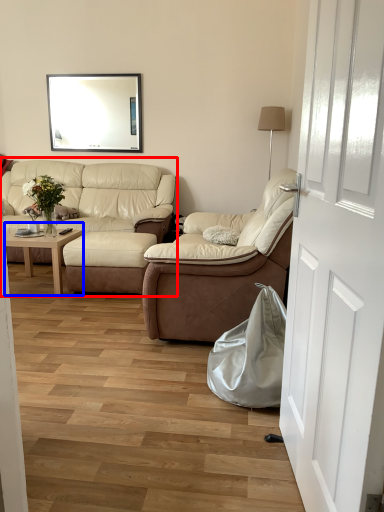
Question: Which of the following is the farthest to the observer, studio couch (highlighted by a red box) or coffee table (highlighted by a blue box)?

Choices:
 (A) studio couch
 (B) coffee table

Answer: (A)